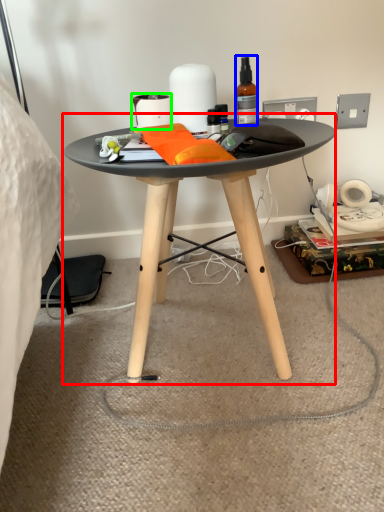
Question: Which object is the closest to the coffee table (highlighted by a red box)? Choose among these: bottle (highlighted by a blue box) or toilet paper (highlighted by a green box).

Choices:
 (A) bottle
 (B) toilet paper

Answer: (B)